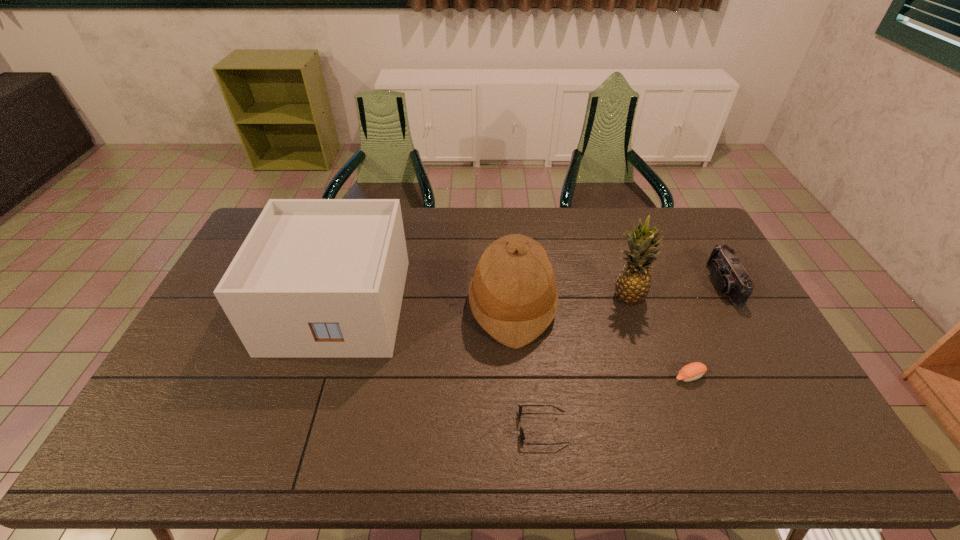
Identify the location of vacant region between the third shortest object and the sushi. The image size is (960, 540). (706, 330).

Image resolution: width=960 pixels, height=540 pixels. I want to click on vacant space that's between the fourth tallest object and the second nearest object, so click(706, 330).

The width and height of the screenshot is (960, 540). Identify the location of vacant area that lies between the second nearest object and the shortest object. (616, 402).

At what (x,y) coordinates should I click in order to perform the action: click on vacant area between the shortest object and the third shortest object. Please return your answer as a coordinate pair (x, y). This screenshot has width=960, height=540. Looking at the image, I should click on coord(633,356).

Identify the location of free space between the rightmost object and the sunglasses. (633, 356).

Find the location of a particular element. object that is the fourth nearest to the pineapple is located at coordinates (522, 437).

Identify which object is the fifth closest to the pineapple. Please provide its 2D coordinates. Your answer should be formatted as a tuple, i.e. [(x, y)], where the tuple contains the x and y coordinates of a point satisfying the conditions above.

[(315, 278)]

Locate an element on the screen. This screenshot has height=540, width=960. vacant region that satisfies the following two spatial constraints: 1. on the front-facing side of the fifth farthest object; 2. on the right side of the hat is located at coordinates point(517,376).

Locate an element on the screen. This screenshot has height=540, width=960. free space that satisfies the following two spatial constraints: 1. on the side of the second shortest object with the window; 2. on the left side of the leftmost object is located at coordinates [316, 376].

You are a GUI agent. You are given a task and a screenshot of the screen. Output one action in this format:
    pyautogui.click(x=<x>, y=<y>)
    Task: Click on the free point that satisfies the following two spatial constraints: 1. on the front-facing side of the hat; 2. on the left side of the second shortest object
    This screenshot has width=960, height=540.
    Given the screenshot: What is the action you would take?
    pyautogui.click(x=517, y=376)